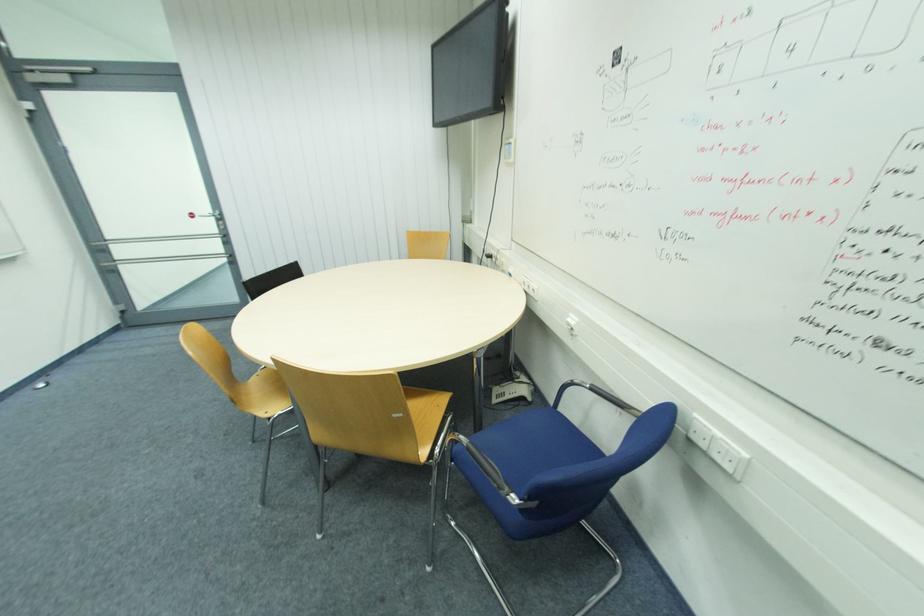
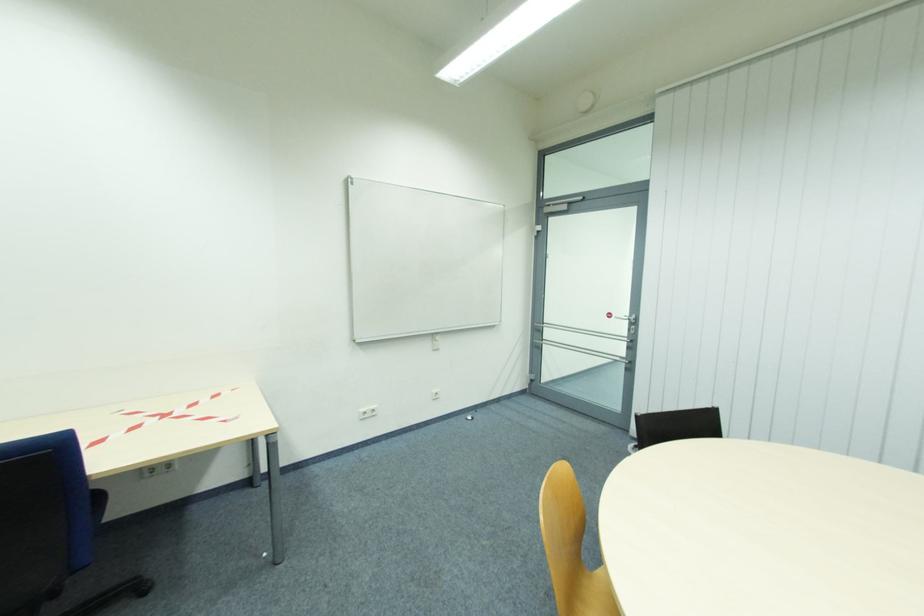
Question: Based on the continuous images, in which direction is the camera rotating? Reply with the corresponding letter.

Choices:
 (A) Left
 (B) Right
 (C) Up
 (D) Down

Answer: (A)